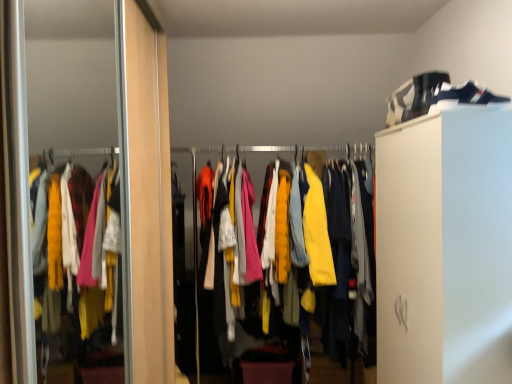
Question: Is matte yellow jackets at center not inside wooden screen door at left?

Choices:
 (A) no
 (B) yes

Answer: (B)

Question: Is matte yellow jackets at center shorter than wooden screen door at left?

Choices:
 (A) no
 (B) yes

Answer: (B)

Question: Does matte yellow jackets at center have a greater height compared to wooden screen door at left?

Choices:
 (A) yes
 (B) no

Answer: (B)

Question: Considering the relative sizes of matte yellow jackets at center and wooden screen door at left in the image provided, is matte yellow jackets at center wider than wooden screen door at left?

Choices:
 (A) no
 (B) yes

Answer: (B)

Question: Is matte yellow jackets at center beside wooden screen door at left?

Choices:
 (A) yes
 (B) no

Answer: (B)

Question: In the image, is camouflage fabric shoe at upper right on the left side or the right side of matte yellow jackets at center?

Choices:
 (A) left
 (B) right

Answer: (B)

Question: Does point (426, 77) appear closer or farther from the camera than point (196, 316)?

Choices:
 (A) closer
 (B) farther

Answer: (A)

Question: In terms of size, does camouflage fabric shoe at upper right appear bigger or smaller than matte yellow jackets at center?

Choices:
 (A) big
 (B) small

Answer: (B)

Question: In terms of height, does camouflage fabric shoe at upper right look taller or shorter compared to matte yellow jackets at center?

Choices:
 (A) short
 (B) tall

Answer: (A)

Question: In terms of height, does wooden screen door at left look taller or shorter compared to camouflage fabric shoe at upper right?

Choices:
 (A) short
 (B) tall

Answer: (B)

Question: Considering their positions, is wooden screen door at left located in front of or behind camouflage fabric shoe at upper right?

Choices:
 (A) behind
 (B) front

Answer: (B)

Question: Considering the positions of wooden screen door at left and camouflage fabric shoe at upper right in the image, is wooden screen door at left wider or thinner than camouflage fabric shoe at upper right?

Choices:
 (A) thin
 (B) wide

Answer: (B)

Question: From a real-world perspective, is wooden screen door at left physically located above or below camouflage fabric shoe at upper right?

Choices:
 (A) below
 (B) above

Answer: (A)

Question: Looking at the image, does camouflage fabric shoe at upper right seem bigger or smaller compared to wooden screen door at left?

Choices:
 (A) big
 (B) small

Answer: (B)

Question: From a real-world perspective, is camouflage fabric shoe at upper right positioned above or below wooden screen door at left?

Choices:
 (A) below
 (B) above

Answer: (B)